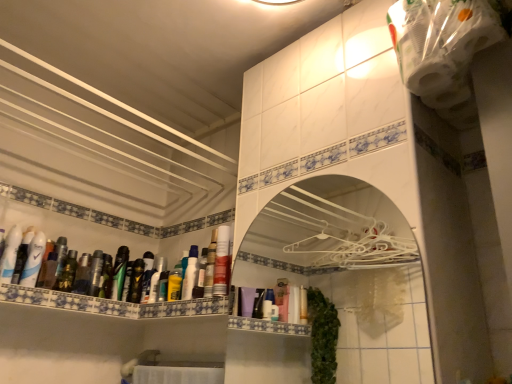
Measure the distance between white glossy bottle at upper left, the 4th mouthwash in the right-to-left sequence, and camera.

white glossy bottle at upper left, the 4th mouthwash in the right-to-left sequence, and camera are 1.50 meters apart.

What is the approximate width of green matte bottle at left, positioned as the 5th mouthwash in left-to-right order?

The width of green matte bottle at left, positioned as the 5th mouthwash in left-to-right order, is 1.91 inches.

Where is `translucent plastic bottle at center, which is the eleventh mouthwash in left-to-right order`? translucent plastic bottle at center, which is the eleventh mouthwash in left-to-right order is located at coordinates (210, 265).

Describe the element at coordinates (147, 276) in the screenshot. I see `matte plastic mouthwash at left, acting as the 8th mouthwash starting from the left` at that location.

Locate an element on the screen. Image resolution: width=512 pixels, height=384 pixels. white glossy bottle at upper left, the 4th mouthwash in the right-to-left sequence is located at coordinates (156, 280).

Locate an element on the screen. This screenshot has width=512, height=384. the 8th mouthwash positioned above the matte plastic mouthwash at left, the 5th mouthwash when ordered from right to left (from the image's perspective) is located at coordinates (210, 265).

Does point (148, 287) appear closer or farther from the camera than point (213, 259)?

Clearly, point (148, 287) is more distant from the camera than point (213, 259).

Does matte plastic mouthwash at left, the 5th mouthwash when ordered from right to left, have a greater height compared to translucent plastic bottle at center, which is the eleventh mouthwash in left-to-right order?

In fact, matte plastic mouthwash at left, the 5th mouthwash when ordered from right to left, may be shorter than translucent plastic bottle at center, which is the eleventh mouthwash in left-to-right order.

From a real-world perspective, which is physically above, matte plastic mouthwash at left, the 5th mouthwash when ordered from right to left, or translucent plastic bottle at center, which appears as the second mouthwash when viewed from the right?

translucent plastic bottle at center, which appears as the second mouthwash when viewed from the right.

Relative to green matte toothpaste at left, marked as the seventh mouthwash in a right-to-left arrangement, is metallic silver mouthwash at left, acting as the seventh mouthwash starting from the left, in front or behind?

Clearly, metallic silver mouthwash at left, acting as the seventh mouthwash starting from the left, is behind green matte toothpaste at left, marked as the seventh mouthwash in a right-to-left arrangement.

Does metallic silver mouthwash at left, which is the sixth mouthwash in right-to-left order, have a lesser height compared to green matte toothpaste at left, marked as the seventh mouthwash in a right-to-left arrangement?

Indeed, metallic silver mouthwash at left, which is the sixth mouthwash in right-to-left order, has a lesser height compared to green matte toothpaste at left, marked as the seventh mouthwash in a right-to-left arrangement.

Which point is more forward, (136, 302) or (121, 279)?

The point (136, 302) is closer.

Is metallic silver mouthwash at left, acting as the seventh mouthwash starting from the left, facing towards green matte toothpaste at left, marked as the seventh mouthwash in a right-to-left arrangement?

No, metallic silver mouthwash at left, acting as the seventh mouthwash starting from the left, does not turn towards green matte toothpaste at left, marked as the seventh mouthwash in a right-to-left arrangement.

Is green matte mouthwash at left, which ranks as the 10th mouthwash in right-to-left order, facing towards metallic silver mouthwash at left, acting as the seventh mouthwash starting from the left?

No, green matte mouthwash at left, which ranks as the 10th mouthwash in right-to-left order, is not aimed at metallic silver mouthwash at left, acting as the seventh mouthwash starting from the left.

Measure the distance between green matte mouthwash at left, which is the 3th mouthwash in left-to-right order, and metallic silver mouthwash at left, acting as the seventh mouthwash starting from the left.

A distance of 9.05 inches exists between green matte mouthwash at left, which is the 3th mouthwash in left-to-right order, and metallic silver mouthwash at left, acting as the seventh mouthwash starting from the left.

In terms of width, does green matte mouthwash at left, which ranks as the 10th mouthwash in right-to-left order, look wider or thinner when compared to metallic silver mouthwash at left, which is the sixth mouthwash in right-to-left order?

green matte mouthwash at left, which ranks as the 10th mouthwash in right-to-left order, is wider than metallic silver mouthwash at left, which is the sixth mouthwash in right-to-left order.

Is green matte mouthwash at left, which is the 3th mouthwash in left-to-right order, bigger than metallic silver mouthwash at left, acting as the seventh mouthwash starting from the left?

No, green matte mouthwash at left, which is the 3th mouthwash in left-to-right order, is not bigger than metallic silver mouthwash at left, acting as the seventh mouthwash starting from the left.

Can you confirm if matte plastic bottles at left is positioned to the left of matte black tube at left, the 3th toiletry positioned from the back?

Incorrect, matte plastic bottles at left is not on the left side of matte black tube at left, the 3th toiletry positioned from the back.

In the scene shown: Does matte plastic bottles at left have a larger size compared to matte black tube at left, which is counted as the 1th toiletry, starting from the front?

Yes.

The width and height of the screenshot is (512, 384). I want to click on ledge on the right of matte black tube at left, positioned as the 3th toiletry in right-to-left order, so click(x=113, y=304).

Considering the sizes of objects matte plastic bottles at left and matte black tube at left, positioned as the 3th toiletry in right-to-left order, in the image provided, who is shorter, matte plastic bottles at left or matte black tube at left, positioned as the 3th toiletry in right-to-left order,?

With less height is matte plastic bottles at left.

From the image's perspective, does white glossy mouthwash at upper center, which is the 1th mouthwash in right-to-left order, appear lower than matte plastic bottles at left?

No.

Can you tell me how much white glossy mouthwash at upper center, acting as the 12th mouthwash starting from the left, and matte plastic bottles at left differ in facing direction?

88.9 degrees separate the facing orientations of white glossy mouthwash at upper center, acting as the 12th mouthwash starting from the left, and matte plastic bottles at left.

Which is more to the left, white glossy mouthwash at upper center, acting as the 12th mouthwash starting from the left, or matte plastic bottles at left?

matte plastic bottles at left is more to the left.

Is point (227, 234) less distant than point (109, 309)?

Yes.

Considering the relative positions of matte plastic bottles at left and green matte bottle at left, placed as the eighth mouthwash when sorted from right to left, in the image provided, is matte plastic bottles at left to the left of green matte bottle at left, placed as the eighth mouthwash when sorted from right to left, from the viewer's perspective?

Correct, you'll find matte plastic bottles at left to the left of green matte bottle at left, placed as the eighth mouthwash when sorted from right to left.

In terms of size, does matte plastic bottles at left appear bigger or smaller than green matte bottle at left, positioned as the 5th mouthwash in left-to-right order?

Clearly, matte plastic bottles at left is larger in size than green matte bottle at left, positioned as the 5th mouthwash in left-to-right order.

Does point (52, 306) come behind point (99, 273)?

No, it is in front of (99, 273).

Is matte plastic bottles at left beside green matte bottle at left, placed as the eighth mouthwash when sorted from right to left?

matte plastic bottles at left and green matte bottle at left, placed as the eighth mouthwash when sorted from right to left, are clearly separated.

From a real-world perspective, is white glossy medicine cabinet at center below yellow matte bottle at center, the tenth mouthwash when ordered from left to right?

Indeed, from a real-world perspective, white glossy medicine cabinet at center is positioned beneath yellow matte bottle at center, the tenth mouthwash when ordered from left to right.

Which is behind, white glossy medicine cabinet at center or yellow matte bottle at center, the tenth mouthwash when ordered from left to right?

yellow matte bottle at center, the tenth mouthwash when ordered from left to right, is more distant.

How many degrees apart are the facing directions of white glossy medicine cabinet at center and yellow matte bottle at center, the 3th mouthwash positioned from the right?

1.04 degrees.

Between white glossy medicine cabinet at center and yellow matte bottle at center, the tenth mouthwash when ordered from left to right, which one has larger width?

yellow matte bottle at center, the tenth mouthwash when ordered from left to right.

You are a GUI agent. You are given a task and a screenshot of the screen. Output one action in this format:
    pyautogui.click(x=<x>, y=<y>)
    Task: Click on the 7th mouthwash located beneath the translucent plastic bottle at center, which appears as the second mouthwash when viewed from the right (from a real-world perspective)
    The width and height of the screenshot is (512, 384).
    Given the screenshot: What is the action you would take?
    pyautogui.click(x=147, y=276)

From the image's perspective, count 2nd mouthwashs upward from the metallic silver mouthwash at left, which is the sixth mouthwash in right-to-left order, and point to it. Please provide its 2D coordinates.

[(119, 273)]

When comparing their distances from metallic silver mouthwash at left, acting as the seventh mouthwash starting from the left, does matte plastic bottles at left or green matte bottle at center, positioned as the 3th toiletry in front-to-back order, seem further?

Based on the image, matte plastic bottles at left appears to be further to metallic silver mouthwash at left, acting as the seventh mouthwash starting from the left.

Considering their positions, is green matte bottle at center, which ranks as the 3th toiletry in left-to-right order, positioned closer to matte black tube at left, the 3th toiletry positioned from the back, than green matte mouthwash at left, which is the 3th mouthwash in left-to-right order?

green matte mouthwash at left, which is the 3th mouthwash in left-to-right order, is closer to matte black tube at left, the 3th toiletry positioned from the back.

From the image, which object appears to be nearer to metallic silver mouthwash at left, which is the sixth mouthwash in right-to-left order, white glossy mouthwash at left, the 1th mouthwash positioned from the left, or white glossy bottle at upper left, positioned as the ninth mouthwash in left-to-right order?

white glossy bottle at upper left, positioned as the ninth mouthwash in left-to-right order, is closer to metallic silver mouthwash at left, which is the sixth mouthwash in right-to-left order.

From the image, which object appears to be nearer to matte plastic bottles at left, yellow matte bottle at center, the tenth mouthwash when ordered from left to right, or matte plastic mouthwash at left, the 5th mouthwash when ordered from right to left?

The object closer to matte plastic bottles at left is yellow matte bottle at center, the tenth mouthwash when ordered from left to right.

From the image, which object appears to be nearer to matte black tube at left, positioned as the 3th toiletry in right-to-left order, green matte mouthwash at left, which ranks as the 10th mouthwash in right-to-left order, or green matte bottle at center, the 1th toiletry viewed from the back?

The object closer to matte black tube at left, positioned as the 3th toiletry in right-to-left order, is green matte mouthwash at left, which ranks as the 10th mouthwash in right-to-left order.

Considering their positions, is translucent plastic bottle at center, which appears as the second mouthwash when viewed from the right, positioned further to white glossy mouthwash at upper center, acting as the 12th mouthwash starting from the left, than white glossy medicine cabinet at center?

Among the two, white glossy medicine cabinet at center is located further to white glossy mouthwash at upper center, acting as the 12th mouthwash starting from the left.

Which object lies further to the anchor point green matte toothpaste at left, marked as the seventh mouthwash in a right-to-left arrangement, translucent plastic bottle at center, which is the eleventh mouthwash in left-to-right order, or white glossy mouthwash at left, the 11th mouthwash viewed from the right?

translucent plastic bottle at center, which is the eleventh mouthwash in left-to-right order, lies further to green matte toothpaste at left, marked as the seventh mouthwash in a right-to-left arrangement, than the other object.

Considering their positions, is translucent plastic bottle at center, which appears as the second mouthwash when viewed from the right, positioned closer to matte black tube at left, the 3th toiletry positioned from the back, than green matte mouthwash at left, which is the 3th mouthwash in left-to-right order?

Based on the image, green matte mouthwash at left, which is the 3th mouthwash in left-to-right order, appears to be nearer to matte black tube at left, the 3th toiletry positioned from the back.

Where is `ledge between white glossy mouthwash at left, the 11th mouthwash viewed from the right, and green matte bottle at center, positioned as the 3th toiletry in front-to-back order, in the horizontal direction`? ledge between white glossy mouthwash at left, the 11th mouthwash viewed from the right, and green matte bottle at center, positioned as the 3th toiletry in front-to-back order, in the horizontal direction is located at coordinates (113, 304).

Locate an element on the screen. Image resolution: width=512 pixels, height=384 pixels. ledge located between white glossy mouthwash at left, placed as the 12th mouthwash when sorted from right to left, and green matte bottle at center, which ranks as the 3th toiletry in left-to-right order, in the left-right direction is located at coordinates (113, 304).

Where is `toiletry situated between white glossy mouthwash at left, which is counted as the 2th mouthwash, starting from the left, and white glossy bottle at upper left, positioned as the ninth mouthwash in left-to-right order, from left to right`? The height and width of the screenshot is (384, 512). toiletry situated between white glossy mouthwash at left, which is counted as the 2th mouthwash, starting from the left, and white glossy bottle at upper left, positioned as the ninth mouthwash in left-to-right order, from left to right is located at coordinates (106, 277).

The width and height of the screenshot is (512, 384). In order to click on ledge located between matte black tube at left, which is counted as the 1th toiletry, starting from the front, and translucent plastic bottle at center, which is the eleventh mouthwash in left-to-right order, in the left-right direction in this screenshot , I will do `click(113, 304)`.